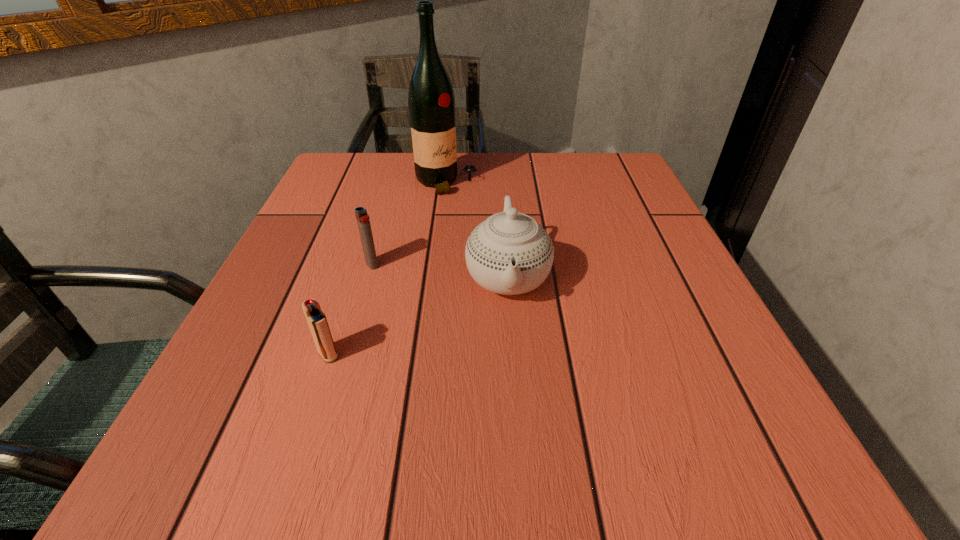
Image resolution: width=960 pixels, height=540 pixels. I want to click on the farthest object, so click(x=431, y=101).

At what (x,y) coordinates should I click in order to perform the action: click on wine bottle. Please return your answer as a coordinate pair (x, y). Looking at the image, I should click on (431, 101).

This screenshot has width=960, height=540. Identify the location of chinaware. (509, 253).

Locate an element on the screen. the farther igniter is located at coordinates (363, 222).

Locate an element on the screen. The image size is (960, 540). the nearest object is located at coordinates (316, 319).

The width and height of the screenshot is (960, 540). I want to click on vacant space located on the right of the farthest object, so click(x=553, y=183).

Locate an element on the screen. The width and height of the screenshot is (960, 540). vacant space located on the spout of the second tallest object is located at coordinates (519, 441).

Find the location of a particular element. The width and height of the screenshot is (960, 540). free spot located on the right of the farther igniter is located at coordinates (551, 265).

In order to click on vacant point located 0.100m on the left of the nearer igniter in this screenshot , I will do `click(251, 354)`.

Locate an element on the screen. Image resolution: width=960 pixels, height=540 pixels. object situated at the far edge is located at coordinates (431, 101).